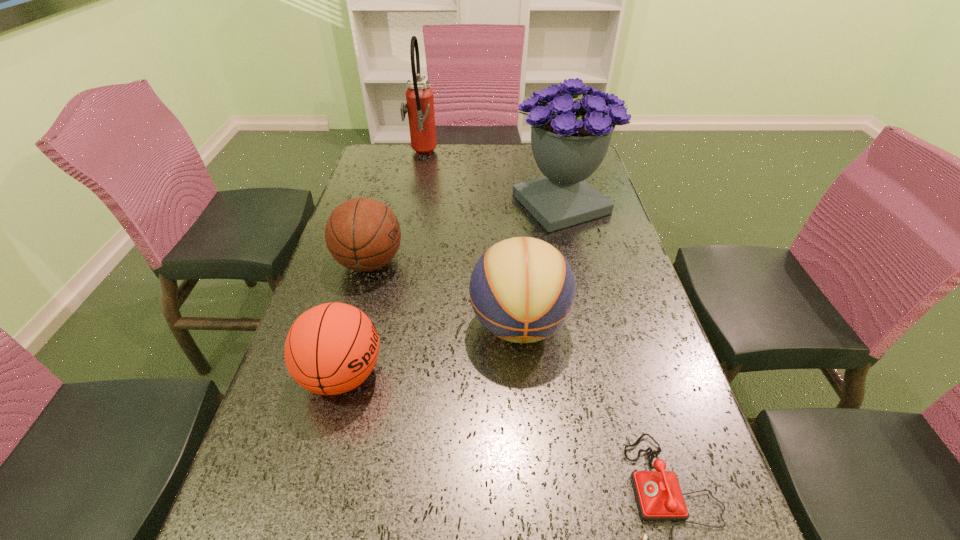
The height and width of the screenshot is (540, 960). Identify the location of fire extinguisher at the left edge. (420, 104).

In order to click on object situated at the right edge in this screenshot , I will do `click(569, 140)`.

Where is `object at the far left corner`? object at the far left corner is located at coordinates (420, 104).

The width and height of the screenshot is (960, 540). I want to click on vacant space at the far edge, so click(x=505, y=159).

What are the coordinates of `blank space at the left edge` in the screenshot? It's located at (263, 500).

Where is `free point at the right edge`? The width and height of the screenshot is (960, 540). free point at the right edge is located at coordinates (636, 341).

At what (x,y) coordinates should I click in order to perform the action: click on vacant space at the far left corner of the desktop. Please return your answer as a coordinate pair (x, y). Looking at the image, I should click on (372, 150).

At what (x,y) coordinates should I click in order to perform the action: click on free spot between the farthest object and the rightmost basketball. Please return your answer as a coordinate pair (x, y). The height and width of the screenshot is (540, 960). Looking at the image, I should click on (470, 240).

Find the location of a particular element. Image resolution: width=960 pixels, height=540 pixels. vacant space in between the third farthest object and the fourth shortest object is located at coordinates (444, 294).

Locate an element on the screen. This screenshot has height=540, width=960. free spot between the rightmost basketball and the farthest object is located at coordinates (470, 240).